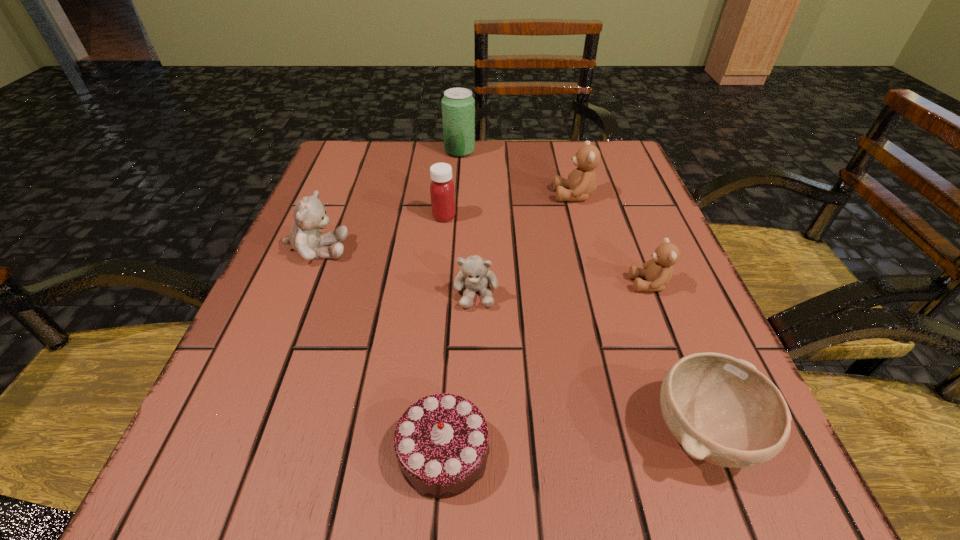
Locate an element on the screen. the right gray teddy bear is located at coordinates (475, 275).

I want to click on the third teddy bear from right to left, so click(475, 275).

I want to click on beige bowl, so click(x=722, y=410).

This screenshot has width=960, height=540. Find the location of `chocolate cake`. chocolate cake is located at coordinates click(441, 442).

Locate an element on the screen. the shortest object is located at coordinates (441, 442).

The image size is (960, 540). I want to click on blank space located on the front of the tallest object, so click(452, 264).

You are a GUI agent. You are given a task and a screenshot of the screen. Output one action in this format:
    pyautogui.click(x=<x>, y=<y>)
    Task: Click on the vacant space positioned 0.190m on the front-facing side of the left brown teddy bear
    
    Given the screenshot: What is the action you would take?
    pyautogui.click(x=468, y=195)

Where is `free space located on the front-facing side of the left brown teddy bear`? The image size is (960, 540). free space located on the front-facing side of the left brown teddy bear is located at coordinates (406, 195).

I want to click on vacant region located on the front-facing side of the left brown teddy bear, so point(455,195).

Locate an element on the screen. The height and width of the screenshot is (540, 960). free location located 0.300m on the face of the left gray teddy bear is located at coordinates (504, 249).